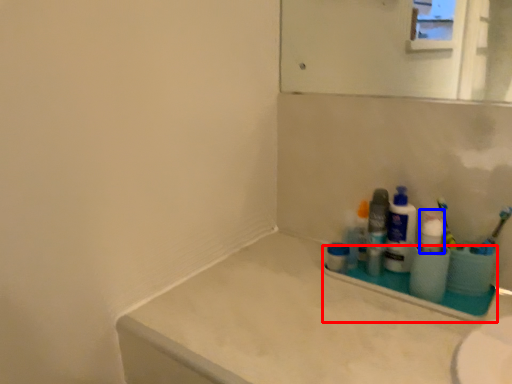
Question: Which object is closer to the camera taking this photo, window sill (highlighted by a red box) or cleaning product (highlighted by a blue box)?

Choices:
 (A) window sill
 (B) cleaning product

Answer: (A)